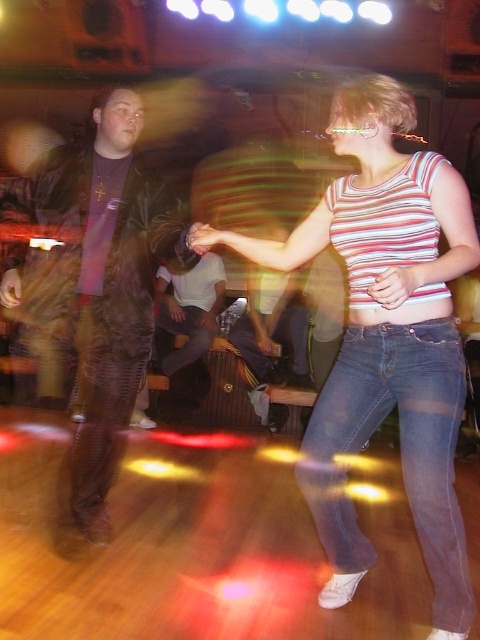
You are a photographer positioned at the center of the dance floor. You want to take a photo of the leather jacket at left. Which direction should you move to get a clearer shot?

Since the leather jacket at left is located at point (94, 288), you should move to the left to get a clearer shot.